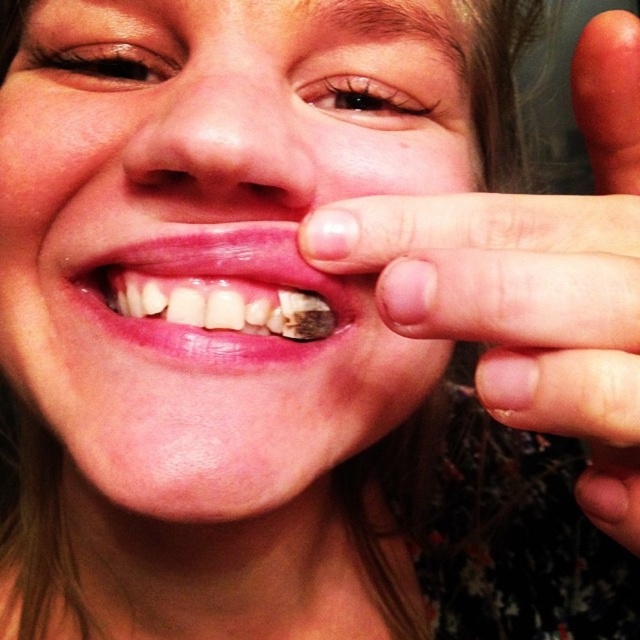
Question: Estimate the real-world distances between objects in this image. Which object is farther from the smooth skin at center?

Choices:
 (A) brown matte tooth at center
 (B) smooth skin hand at right

Answer: (B)

Question: Can you confirm if smooth skin hand at right is wider than brown matte tooth at center?

Choices:
 (A) yes
 (B) no

Answer: (A)

Question: Is smooth skin at center bigger than brown matte tooth at center?

Choices:
 (A) no
 (B) yes

Answer: (B)

Question: From the image, what is the correct spatial relationship of smooth skin at center in relation to brown matte tooth at center?

Choices:
 (A) above
 (B) below

Answer: (B)

Question: Which point appears farthest from the camera in this image?

Choices:
 (A) (502, 396)
 (B) (164, 308)
 (C) (328, 237)

Answer: (B)

Question: Which point is farther to the camera?

Choices:
 (A) (45, 323)
 (B) (609, 378)

Answer: (A)